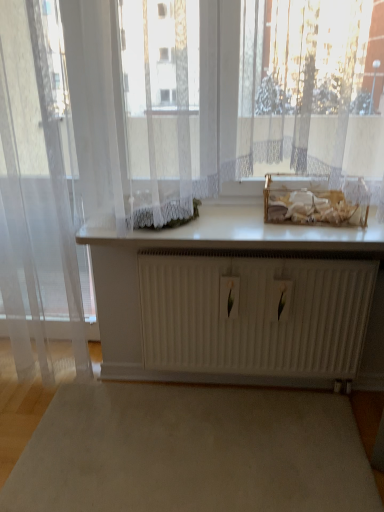
Locate an element on the screen. The image size is (384, 512). transparent fabric curtain at left is located at coordinates pyautogui.click(x=40, y=188).

Where is `white matte radiator at center`? white matte radiator at center is located at coordinates (240, 302).

At what (x,y) coordinates should I click in order to perform the action: click on beige carpet at center. Please return your answer as a coordinate pair (x, y). Looking at the image, I should click on (192, 452).

Is point (279, 368) positioned in front of point (12, 169)?

No, it is not.

Is transparent fabric curtain at left surrounded by white matte radiator at center?

That's incorrect, transparent fabric curtain at left is not inside white matte radiator at center.

From the image's perspective, is white matte radiator at center located above transparent fabric curtain at left?

Incorrect, from the image's perspective, white matte radiator at center is lower than transparent fabric curtain at left.

Is white matte radiator at center next to transparent fabric curtain at left?

No, white matte radiator at center is not beside transparent fabric curtain at left.

Are white glossy counter top at center and beige carpet at center located far from each other?

white glossy counter top at center is near beige carpet at center, not far away.

Is white glossy counter top at center positioned with its back to beige carpet at center?

No, beige carpet at center is not at the back of white glossy counter top at center.

Is white glossy counter top at center closer to the viewer compared to beige carpet at center?

No.

In the scene shown: Which of these two, white glossy counter top at center or beige carpet at center, stands taller?

Standing taller between the two is white glossy counter top at center.

Is white matte radiator at center touching beige carpet at center?

No, white matte radiator at center is not making contact with beige carpet at center.

Who is more distant, white matte radiator at center or beige carpet at center?

white matte radiator at center is behind.

Which of these two, white matte radiator at center or beige carpet at center, is bigger?

white matte radiator at center is bigger.

Can you confirm if transparent fabric curtain at left is wider than white glossy counter top at center?

Incorrect, the width of transparent fabric curtain at left does not surpass that of white glossy counter top at center.

Can you confirm if transparent fabric curtain at left is positioned to the left of white glossy counter top at center?

Yes, transparent fabric curtain at left is to the left of white glossy counter top at center.

Is transparent fabric curtain at left oriented away from white glossy counter top at center?

No, transparent fabric curtain at left is not facing the opposite direction of white glossy counter top at center.

Between point (71, 219) and point (333, 227), which one is positioned in front?

Positioned in front is point (333, 227).

Looking at this image, does beige carpet at center have a lesser width compared to transparent fabric curtain at left?

Incorrect, the width of beige carpet at center is not less than that of transparent fabric curtain at left.

Is beige carpet at center beside transparent fabric curtain at left?

No, beige carpet at center is not touching transparent fabric curtain at left.

Is beige carpet at center not within transparent fabric curtain at left?

Yes.

Considering the relative sizes of beige carpet at center and white glossy counter top at center in the image provided, is beige carpet at center taller than white glossy counter top at center?

No.

From a real-world perspective, which is physically below, beige carpet at center or white glossy counter top at center?

beige carpet at center is physically lower.

Is beige carpet at center at the left side of white glossy counter top at center?

Yes.

Considering the relative sizes of beige carpet at center and white glossy counter top at center in the image provided, is beige carpet at center thinner than white glossy counter top at center?

In fact, beige carpet at center might be wider than white glossy counter top at center.

From the image's perspective, is transparent fabric curtain at left above white matte radiator at center?

Yes, from the image's perspective, transparent fabric curtain at left is over white matte radiator at center.

Can you tell me how much transparent fabric curtain at left and white matte radiator at center differ in facing direction?

They differ by 1.32 degrees in their facing directions.

From a real-world perspective, is transparent fabric curtain at left over white matte radiator at center?

Yes, from a real-world perspective, transparent fabric curtain at left is over white matte radiator at center

Which object is more forward, transparent fabric curtain at left or white matte radiator at center?

transparent fabric curtain at left is closer to the camera.

At what (x,y) coordinates should I click in order to perform the action: click on table below the transparent fabric curtain at left (from a real-world perspective). Please return your answer as a coordinate pair (x, y). This screenshot has width=384, height=512. Looking at the image, I should click on [240, 302].

This screenshot has width=384, height=512. In order to click on counter top above the beige carpet at center (from a real-world perspective) in this screenshot , I will do `click(244, 234)`.

Which object lies nearer to the anchor point white matte radiator at center, white glossy counter top at center or beige carpet at center?

Among the two, white glossy counter top at center is located nearer to white matte radiator at center.

Estimate the real-world distances between objects in this image. Which object is further from beige carpet at center, white matte radiator at center or white glossy counter top at center?

white glossy counter top at center lies further to beige carpet at center than the other object.

Looking at the image, which one is located closer to transparent fabric curtain at left, beige carpet at center or white matte radiator at center?

white matte radiator at center is positioned closer to the anchor transparent fabric curtain at left.

When comparing their distances from transparent fabric curtain at left, does white glossy counter top at center or white matte radiator at center seem further?

white matte radiator at center.

When comparing their distances from transparent fabric curtain at left, does white glossy counter top at center or beige carpet at center seem closer?

white glossy counter top at center.

Looking at the image, which one is located closer to white glossy counter top at center, transparent fabric curtain at left or white matte radiator at center?

white matte radiator at center.

When comparing their distances from white matte radiator at center, does beige carpet at center or white glossy counter top at center seem closer?

Based on the image, white glossy counter top at center appears to be nearer to white matte radiator at center.

When comparing their distances from transparent fabric curtain at left, does white matte radiator at center or beige carpet at center seem closer?

The object closer to transparent fabric curtain at left is white matte radiator at center.

Locate an element on the screen. This screenshot has width=384, height=512. plain between transparent fabric curtain at left and white matte radiator at center in the horizontal direction is located at coordinates (192, 452).

Where is `table between white glossy counter top at center and beige carpet at center in the vertical direction`? The width and height of the screenshot is (384, 512). table between white glossy counter top at center and beige carpet at center in the vertical direction is located at coordinates pos(240,302).

Identify the location of counter top between transparent fabric curtain at left and beige carpet at center from top to bottom. This screenshot has height=512, width=384. (244, 234).

You are a GUI agent. You are given a task and a screenshot of the screen. Output one action in this format:
    pyautogui.click(x=<x>, y=<y>)
    Task: Click on the counter top between transparent fabric curtain at left and white matte radiator at center
    The image size is (384, 512).
    Given the screenshot: What is the action you would take?
    pyautogui.click(x=244, y=234)